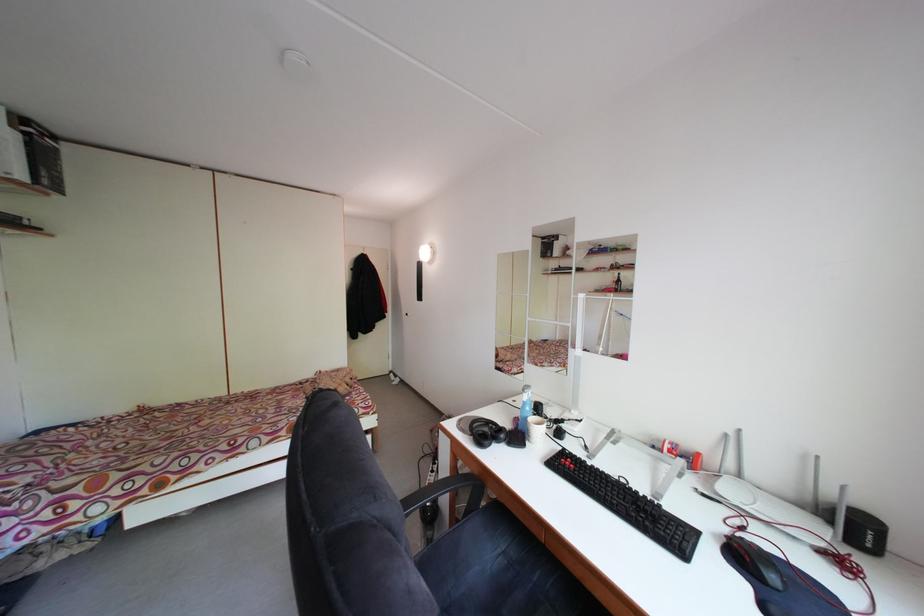
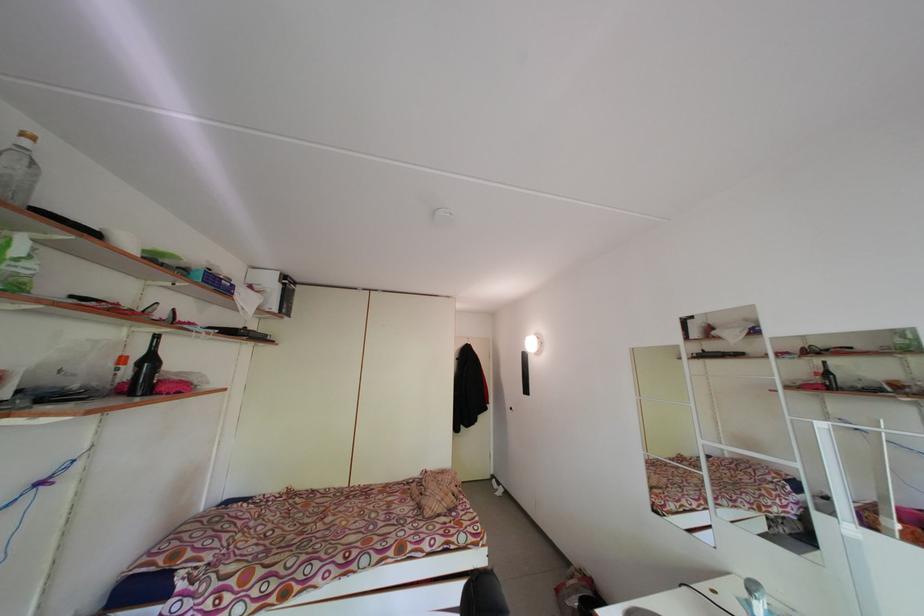
First-person continuous shooting, in which direction is the camera rotating?

The camera rotated toward left-up.